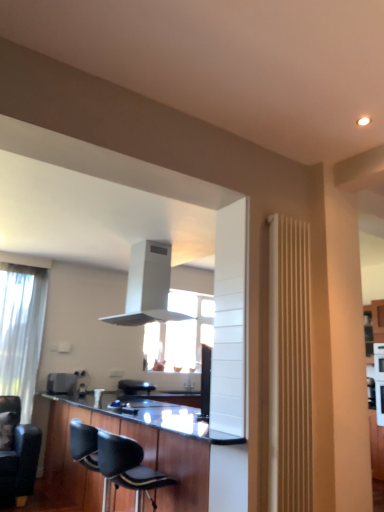
Question: Considering the relative sizes of black leather chair at lower center, which is counted as the second chair, starting from the back, and black leather chair at lower left, the first chair positioned from the back, in the image provided, is black leather chair at lower center, which is counted as the second chair, starting from the back, taller than black leather chair at lower left, the first chair positioned from the back,?

Choices:
 (A) no
 (B) yes

Answer: (A)

Question: Is black leather chair at lower left, the first chair positioned from the back, surrounded by black leather chair at lower center, the 1th chair in the front-to-back sequence?

Choices:
 (A) yes
 (B) no

Answer: (B)

Question: From a real-world perspective, does black leather chair at lower center, the 1th chair in the front-to-back sequence, sit lower than black leather chair at lower left, the first chair positioned from the back?

Choices:
 (A) no
 (B) yes

Answer: (A)

Question: Is black leather chair at lower center, which is counted as the first chair, starting from the right, at the right side of black leather chair at lower left, which is counted as the 2th chair, starting from the front?

Choices:
 (A) no
 (B) yes

Answer: (B)

Question: Considering the relative positions of black leather chair at lower center, arranged as the second chair when viewed from the left, and black leather chair at lower left, the second chair in the right-to-left sequence, in the image provided, is black leather chair at lower center, arranged as the second chair when viewed from the left, to the left of black leather chair at lower left, the second chair in the right-to-left sequence, from the viewer's perspective?

Choices:
 (A) no
 (B) yes

Answer: (A)

Question: Considering the relative sizes of black leather chair at lower center, which is counted as the second chair, starting from the back, and black leather chair at lower left, the second chair in the right-to-left sequence, in the image provided, is black leather chair at lower center, which is counted as the second chair, starting from the back, wider than black leather chair at lower left, the second chair in the right-to-left sequence,?

Choices:
 (A) no
 (B) yes

Answer: (A)

Question: Is white sheer curtain at left oriented towards black leather chair at lower left, the 1th chair from the left?

Choices:
 (A) yes
 (B) no

Answer: (A)

Question: Is white sheer curtain at left in front of black leather chair at lower left, the second chair in the right-to-left sequence?

Choices:
 (A) yes
 (B) no

Answer: (B)

Question: Considering the relative sizes of white sheer curtain at left and black leather chair at lower left, which is counted as the 2th chair, starting from the front, in the image provided, is white sheer curtain at left thinner than black leather chair at lower left, which is counted as the 2th chair, starting from the front,?

Choices:
 (A) yes
 (B) no

Answer: (A)

Question: From the image's perspective, would you say white sheer curtain at left is positioned over black leather chair at lower left, the 1th chair from the left?

Choices:
 (A) no
 (B) yes

Answer: (B)

Question: From a real-world perspective, is white sheer curtain at left on top of black leather chair at lower left, the second chair in the right-to-left sequence?

Choices:
 (A) no
 (B) yes

Answer: (B)

Question: From a real-world perspective, is white sheer curtain at left physically below black leather chair at lower left, which is counted as the 2th chair, starting from the front?

Choices:
 (A) no
 (B) yes

Answer: (A)

Question: Is white matte exhaust hood at upper center further to the viewer compared to black wood cabinetry at lower center?

Choices:
 (A) no
 (B) yes

Answer: (B)